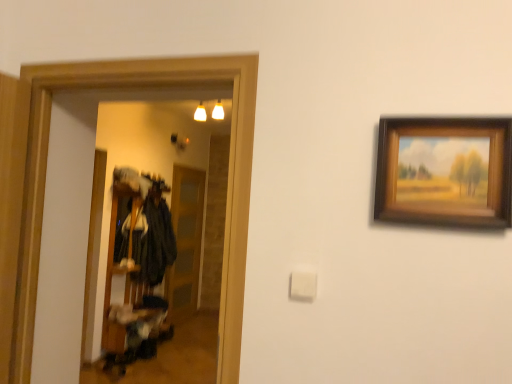
Describe the element at coordinates (185, 241) in the screenshot. The width and height of the screenshot is (512, 384). I see `transparent glass door at center` at that location.

Find the location of `transparent glass door at center`. transparent glass door at center is located at coordinates (185, 241).

The height and width of the screenshot is (384, 512). Find the location of `transparent glass door at center`. transparent glass door at center is located at coordinates (185, 241).

Is velvet black coat at center far away from transparent glass door at center?

Absolutely, velvet black coat at center is distant from transparent glass door at center.

Considering the positions of objects velvet black coat at center and transparent glass door at center in the image provided, who is more to the left, velvet black coat at center or transparent glass door at center?

velvet black coat at center is more to the left.

Looking at this image, which is nearer, (x=155, y=223) or (x=186, y=267)?

Point (x=155, y=223) is positioned closer to the camera compared to point (x=186, y=267).

Which of these two, velvet black coat at center or wooden picture frame at upper right, is wider?

Wider between the two is velvet black coat at center.

Consider the image. Is velvet black coat at center to the left of wooden picture frame at upper right from the viewer's perspective?

Yes, velvet black coat at center is to the left of wooden picture frame at upper right.

Who is shorter, velvet black coat at center or wooden picture frame at upper right?

wooden picture frame at upper right is shorter.

Is velvet black coat at center far from wooden picture frame at upper right?

Yes, velvet black coat at center and wooden picture frame at upper right are located far from each other.

Which object is positioned more to the right, transparent glass door at center or velvet black coat at center?

transparent glass door at center.

Is transparent glass door at center wider or thinner than velvet black coat at center?

transparent glass door at center is thinner than velvet black coat at center.

From the image's perspective, is transparent glass door at center under velvet black coat at center?

Indeed, from the image's perspective, transparent glass door at center is shown beneath velvet black coat at center.

How different are the orientations of transparent glass door at center and velvet black coat at center in degrees?

The angular difference between transparent glass door at center and velvet black coat at center is 3.17 degrees.

Looking at this image, considering the relative sizes of wooden picture frame at upper right and transparent glass door at center in the image provided, is wooden picture frame at upper right bigger than transparent glass door at center?

Actually, wooden picture frame at upper right might be smaller than transparent glass door at center.

Where is `picture frame above the transparent glass door at center (from the image's perspective)`? The height and width of the screenshot is (384, 512). picture frame above the transparent glass door at center (from the image's perspective) is located at coordinates (445, 171).

Is wooden picture frame at upper right next to transparent glass door at center?

There is a gap between wooden picture frame at upper right and transparent glass door at center.

Is point (490, 174) in front of point (201, 187)?

Yes, it is.

Measure the distance between wooden picture frame at upper right and velvet black coat at center.

wooden picture frame at upper right and velvet black coat at center are 3.71 meters apart from each other.

Is wooden picture frame at upper right turned away from velvet black coat at center?

No, wooden picture frame at upper right is not facing away from velvet black coat at center.

From the image's perspective, which is above, wooden picture frame at upper right or velvet black coat at center?

From the image's view, wooden picture frame at upper right is above.

Identify the location of clothing behind the wooden picture frame at upper right. The image size is (512, 384). (154, 242).

Would you say transparent glass door at center is inside or outside wooden picture frame at upper right?

transparent glass door at center exists outside the volume of wooden picture frame at upper right.

From a real-world perspective, who is located lower, transparent glass door at center or wooden picture frame at upper right?

transparent glass door at center, from a real-world perspective.

From the image's perspective, is transparent glass door at center below wooden picture frame at upper right?

Yes.

Considering the relative sizes of transparent glass door at center and wooden picture frame at upper right in the image provided, is transparent glass door at center smaller than wooden picture frame at upper right?

No.

Where is `glass door located on the right of velvet black coat at center`? The width and height of the screenshot is (512, 384). glass door located on the right of velvet black coat at center is located at coordinates (185, 241).

Image resolution: width=512 pixels, height=384 pixels. Find the location of `picture frame in front of the velvet black coat at center`. picture frame in front of the velvet black coat at center is located at coordinates (445, 171).

Based on their spatial positions, is wooden picture frame at upper right or velvet black coat at center closer to transparent glass door at center?

velvet black coat at center is positioned closer to the anchor transparent glass door at center.

In the scene shown: Considering their positions, is transparent glass door at center positioned closer to wooden picture frame at upper right than velvet black coat at center?

velvet black coat at center is closer to wooden picture frame at upper right.

From the picture: Looking at the image, which one is located closer to velvet black coat at center, transparent glass door at center or wooden picture frame at upper right?

The object closer to velvet black coat at center is transparent glass door at center.

Based on their spatial positions, is velvet black coat at center or transparent glass door at center further from wooden picture frame at upper right?

Among the two, transparent glass door at center is located further to wooden picture frame at upper right.

Based on their spatial positions, is velvet black coat at center or wooden picture frame at upper right further from transparent glass door at center?

Among the two, wooden picture frame at upper right is located further to transparent glass door at center.

Based on their spatial positions, is wooden picture frame at upper right or transparent glass door at center closer to velvet black coat at center?

The object closer to velvet black coat at center is transparent glass door at center.

Locate an element on the screen. This screenshot has width=512, height=384. clothing located between wooden picture frame at upper right and transparent glass door at center in the depth direction is located at coordinates (154, 242).